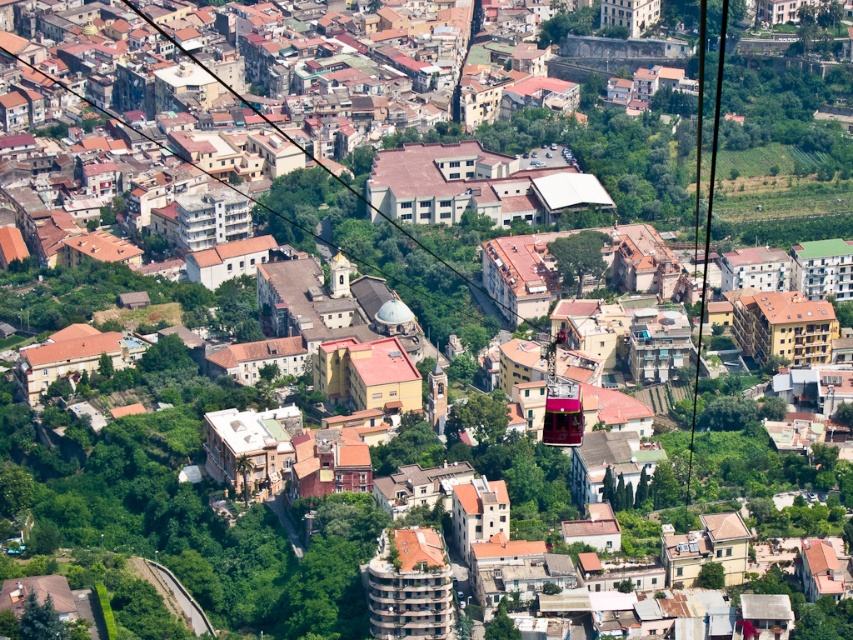
You are a photographer taking a photo from the cable car. You want to capture both the black cable at right and the metallic cable car at center in the same frame. Which object should you adjust your camera angle upwards to include in the photo?

You should adjust your camera angle upwards to include the black cable at right because it is taller than the metallic cable car at center.

You are a photographer taking a picture of the city from the cable car. You notice the black cable at right and the metallic cable car at center. Which object appears larger in your photo?

The black cable at right appears larger in the photo because it is bigger than the metallic cable car at center according to the description.

You are a passenger in the metallic cable car at center and you look out the window. Which side of the car do you see the black cable at right?

The black cable at right is located to the right of the metallic cable car at center, so you would see it on your right side.